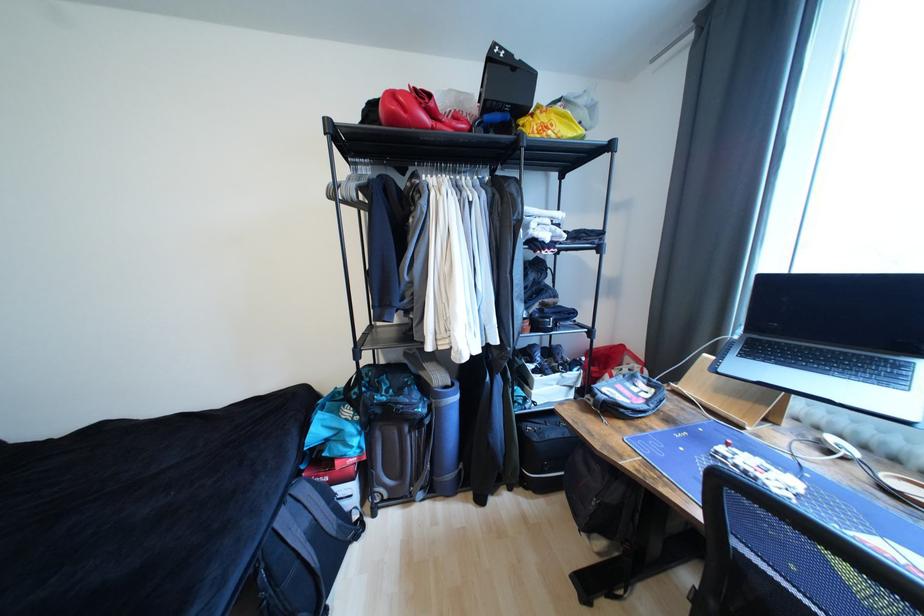
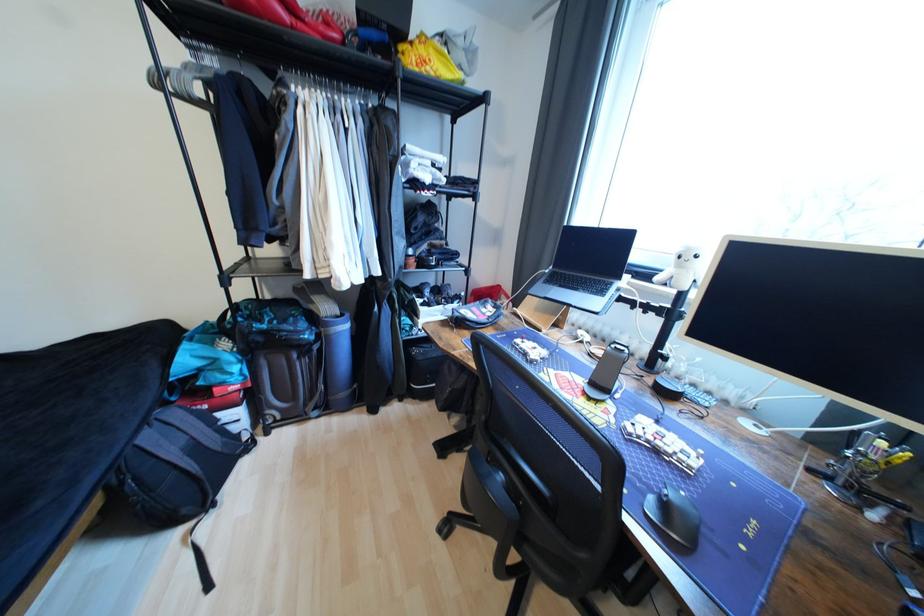
Question: The images are taken continuously from a first-person perspective. In which direction is your viewpoint rotating?

Choices:
 (A) Left
 (B) Right
 (C) Up
 (D) Down

Answer: (B)